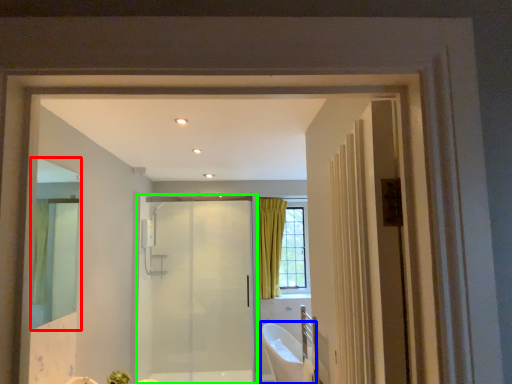
Question: Based on their relative distances, which object is nearer to mirror (highlighted by a red box)? Choose from bath (highlighted by a blue box) and door (highlighted by a green box).

Choices:
 (A) bath
 (B) door

Answer: (B)